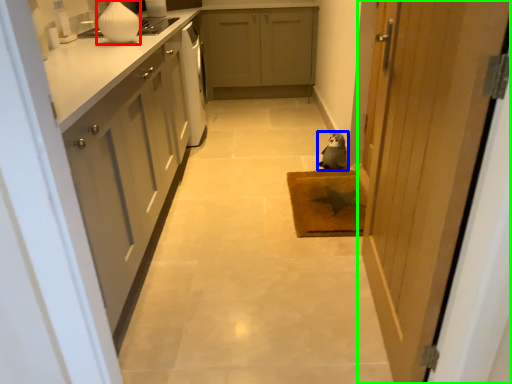
Question: Which is farther away from vase (highlighted by a red box)? animal (highlighted by a blue box) or door (highlighted by a green box)?

Choices:
 (A) animal
 (B) door

Answer: (B)